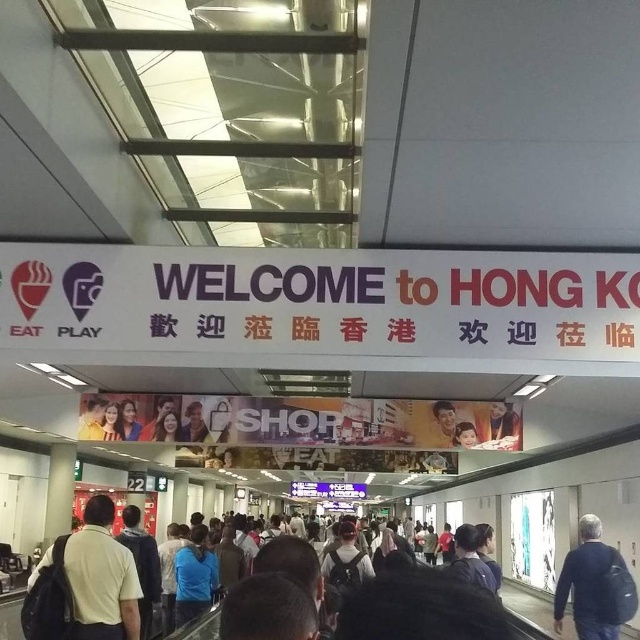
From the picture: Does light brown backpack at center have a smaller size compared to smooth skin face at center?

No.

Between light brown backpack at center and smooth skin face at center, which one appears on the left side from the viewer's perspective?

light brown backpack at center is more to the left.

What do you see at coordinates (102, 572) in the screenshot? I see `light brown backpack at center` at bounding box center [102, 572].

Image resolution: width=640 pixels, height=640 pixels. What are the coordinates of `light brown backpack at center` in the screenshot? It's located at (102, 572).

Does light brown backpack at center appear on the right side of dark blue jacket at lower right?

No, light brown backpack at center is not to the right of dark blue jacket at lower right.

Which is in front, point (96, 573) or point (588, 582)?

Positioned in front is point (96, 573).

Image resolution: width=640 pixels, height=640 pixels. I want to click on light brown backpack at center, so click(102, 572).

Is dark blue jacket at lower right above smooth skin face at center?

Actually, dark blue jacket at lower right is below smooth skin face at center.

Who is positioned more to the right, dark blue jacket at lower right or smooth skin face at center?

dark blue jacket at lower right

Does point (598, 588) come in front of point (467, 436)?

Yes, point (598, 588) is closer to viewer.

The height and width of the screenshot is (640, 640). I want to click on dark blue jacket at lower right, so click(x=595, y=586).